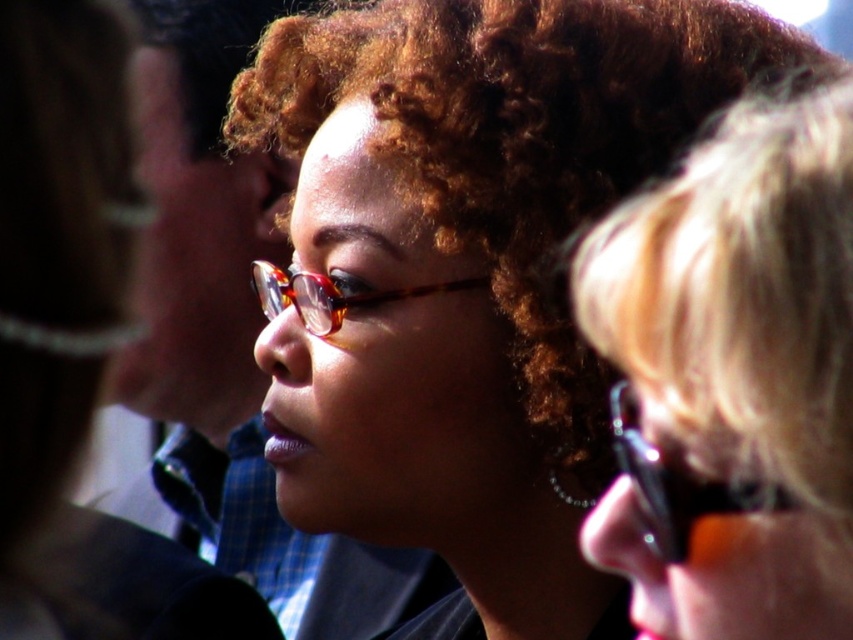
You are a photographer adjusting the focus of your camera. You want to ensure both the matte brown hair at center and the matte black glasses at upper right are in focus. Based on their positions, which object should you focus on first to achieve this?

You should focus on the matte brown hair at center first because it is closer to the viewer than the matte black glasses at upper right, ensuring both are in focus by adjusting the depth of field accordingly.

You are a photographer adjusting the focus of your camera. You want to ensure that both the matte brown hair at center and the tortoiseshell glasses at center are clearly visible. Based on the scene description, which object is closer to the camera and should be in focus first?

The matte brown hair at center is in front of the tortoiseshell glasses at center, so it is closer to the camera and should be focused on first to ensure clarity.